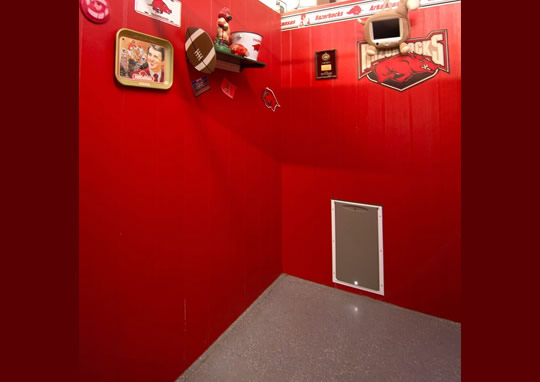
Find the location of a particular element. This screenshot has height=382, width=540. decorative room border is located at coordinates (315, 16).